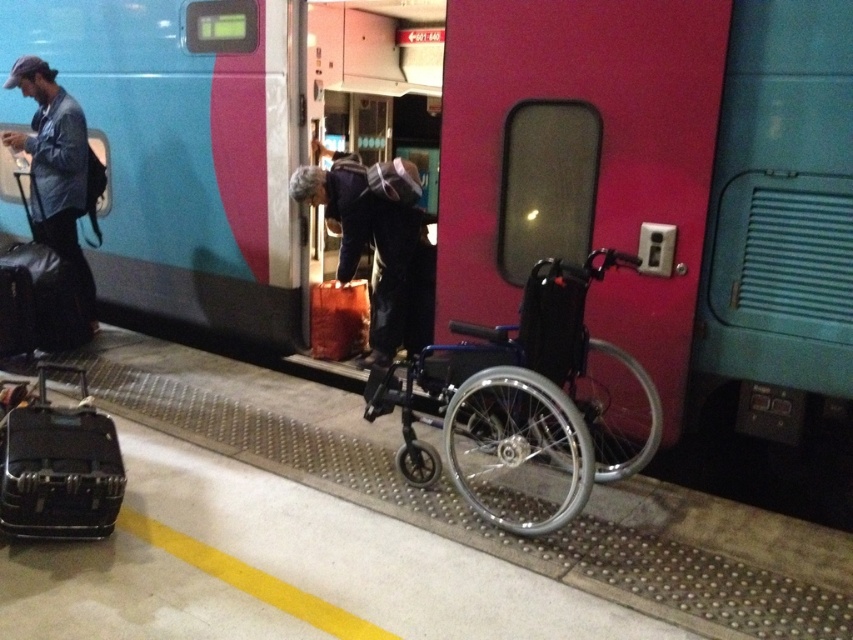
You are standing at the train station and need to board the teal glossy train at center. The platform has a yellow safety line marking its edge. To ensure safety, you must stay behind this line while waiting. Given your current position at point (498, 170), which is the location of the teal glossy train at center, are you positioned safely behind the yellow safety line?

The point (498, 170) corresponds to the teal glossy train at center, which is likely beyond the platform edge marked by the yellow safety line. Therefore, you are not positioned safely behind the yellow safety line.

You are a passenger at the train station. You need to board the teal glossy train at center. There is a blue metallic wheelchair at center blocking your path. Can you walk around the wheelchair to reach the train?

The blue metallic wheelchair at center is behind the teal glossy train at center, so you can walk around the wheelchair to reach the train since it is not in front of the train blocking your path.